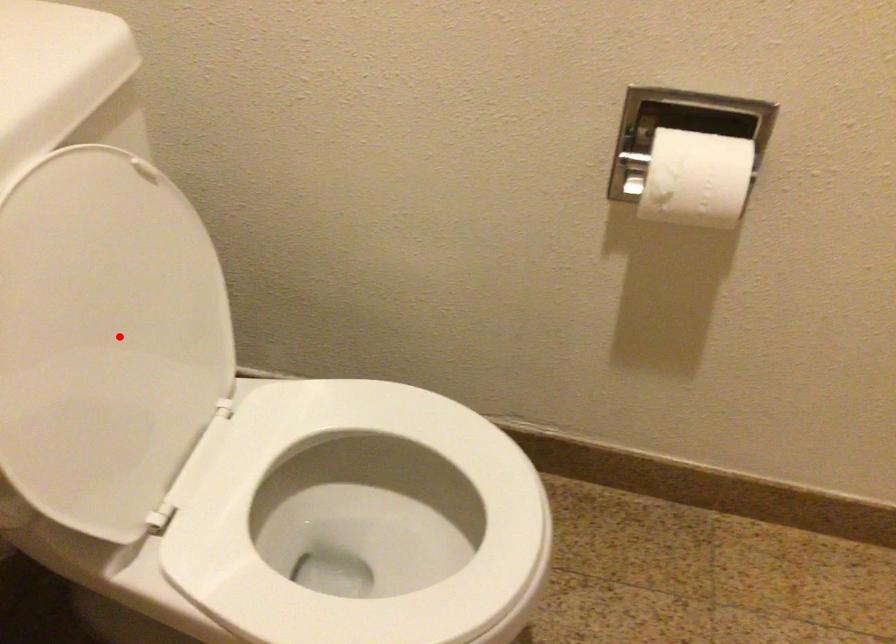
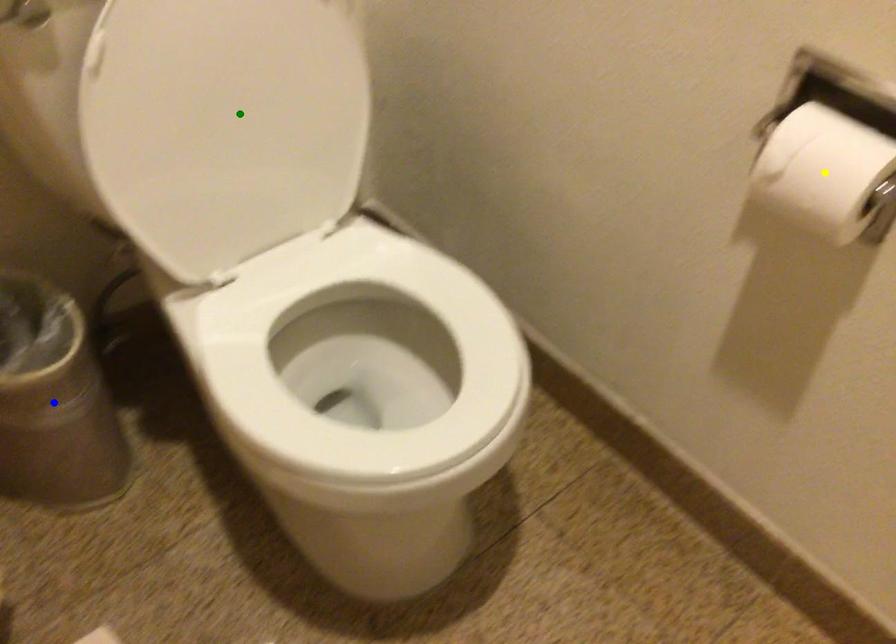
Question: I am providing you with two images of the same scene from different viewpoints. A red point is marked on the first image. You are given multiple points on the second image. Which spot in image 2 lines up with the point in image 1?

Choices:
 (A) green point
 (B) yellow point
 (C) blue point

Answer: (A)